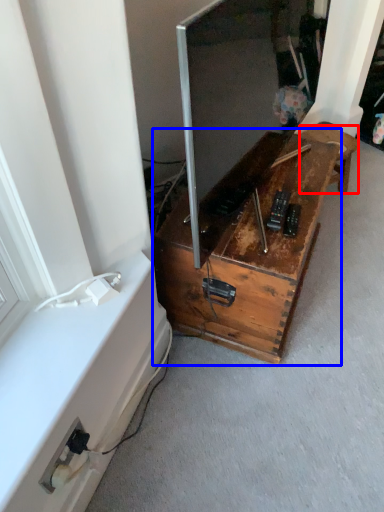
Question: Which of the following is the farthest to the observer, furniture (highlighted by a red box) or furniture (highlighted by a blue box)?

Choices:
 (A) furniture
 (B) furniture

Answer: (A)